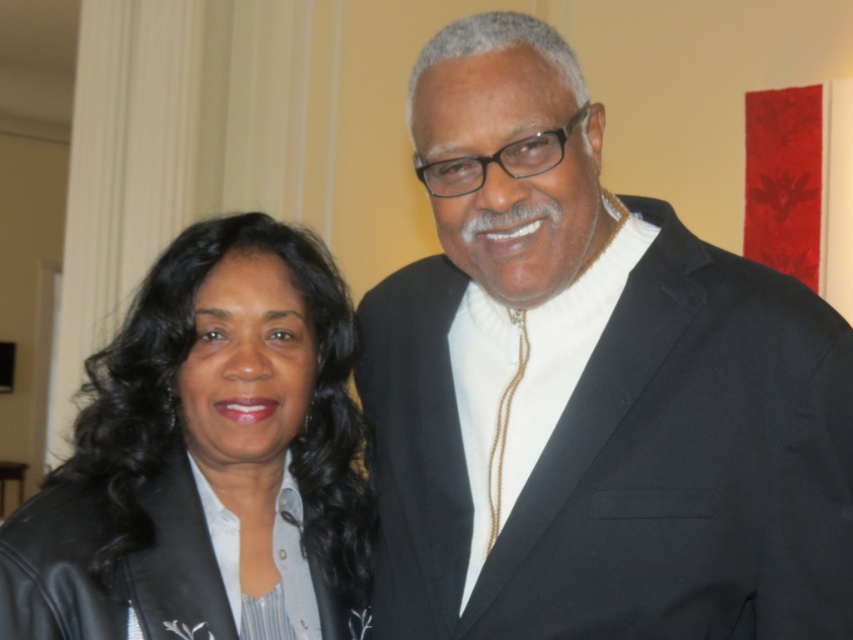
You are at a formal event and want to adjust your clothing. You see a point at coordinates (590, 388) in the image. Which object is located at that point?

The point at coordinates (590, 388) corresponds to the black matte suit at center.

You are standing in front of the two people in the image. You want to hand a gift to the person wearing the leather jacket at left. Which direction should you walk to approach them?

You should walk towards the left to approach the person wearing the leather jacket at left, as it is located at point (207, 458).

You are a photographer at an event and need to ensure that both jackets are visible in the photo. Given that the leather jacket at left and the black leather jacket at lower left are part of the scene, which one might require more space in the frame to accommodate its size?

The leather jacket at left has a larger size compared to the black leather jacket at lower left, so it requires more space in the frame to accommodate its size.